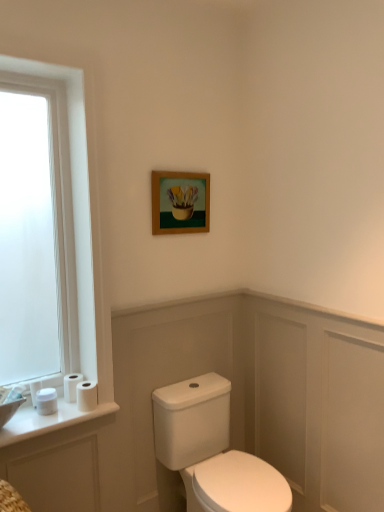
Question: Is point (33, 404) positioned closer to the camera than point (72, 374)?

Choices:
 (A) closer
 (B) farther

Answer: (A)

Question: Is white matte toilet paper at lower left, the fourth toilet paper when ordered from right to left, to the left or to the right of white matte toilet paper at lower left, which ranks as the third toilet paper in left-to-right order, in the image?

Choices:
 (A) right
 (B) left

Answer: (B)

Question: Estimate the real-world distances between objects in this image. Which object is closer to the white matte toilet paper at lower left, acting as the 4th toilet paper starting from the left?

Choices:
 (A) white matte toilet paper at lower left, acting as the second toilet paper starting from the right
 (B) white glossy porcelain at center
 (C) white matte toilet paper at lower left, arranged as the third toilet paper when viewed from the right
 (D) white glossy sink at lower left
 (E) white matte toilet paper at lower left, which appears as the 1th toilet paper when viewed from the left

Answer: (A)

Question: Based on their relative distances, which object is farther from the white glossy sink at lower left?

Choices:
 (A) white matte toilet paper at lower left, arranged as the third toilet paper when viewed from the right
 (B) white matte toilet paper at lower left, positioned as the first toilet paper in right-to-left order
 (C) white matte toilet paper at lower left, which appears as the 1th toilet paper when viewed from the left
 (D) white glossy porcelain at center
 (E) wooden frame at upper center

Answer: (E)